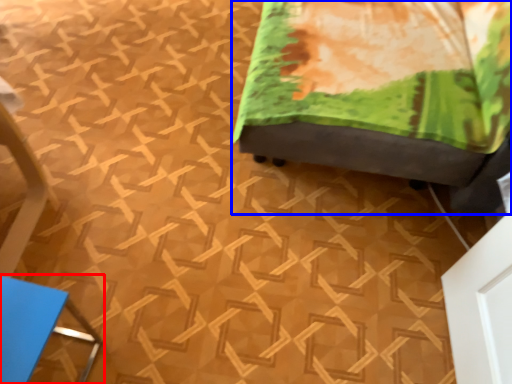
Question: Which object is further to the camera taking this photo, furniture (highlighted by a red box) or furniture (highlighted by a blue box)?

Choices:
 (A) furniture
 (B) furniture

Answer: (B)